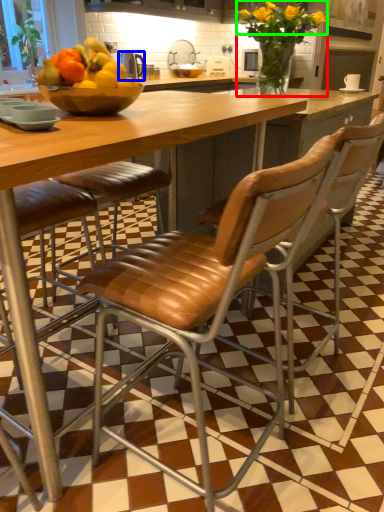
Question: Which is nearer to the flower (highlighted by a red box)? appliance (highlighted by a blue box) or flower (highlighted by a green box).

Choices:
 (A) appliance
 (B) flower

Answer: (B)